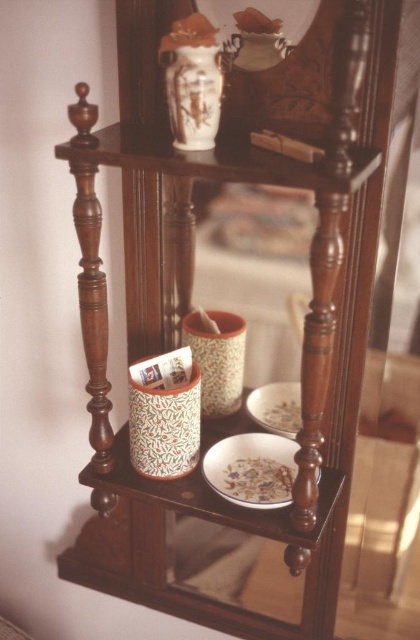
Is point (176, 145) in front of point (260, 413)?

That is True.

Between porcelain vase at upper center and white glossy plate at lower center, which one has more height?

With more height is porcelain vase at upper center.

Find the location of `porcelain vase at upper center`. porcelain vase at upper center is located at coordinates (191, 92).

Does white glossy plate at center appear under porcelain vase at upper center?

Yes, white glossy plate at center is below porcelain vase at upper center.

Who is positioned more to the right, white glossy plate at center or porcelain vase at upper center?

white glossy plate at center

At what (x,y) coordinates should I click in order to perform the action: click on white glossy plate at center. Please return your answer as a coordinate pair (x, y). The width and height of the screenshot is (420, 640). Looking at the image, I should click on (252, 468).

The width and height of the screenshot is (420, 640). Find the location of `white glossy plate at center`. white glossy plate at center is located at coordinates (252, 468).

Is flaky pastry at lower center taller than white matte bowl at lower center?

Yes, flaky pastry at lower center is taller than white matte bowl at lower center.

Is flaky pastry at lower center to the right of white matte bowl at lower center from the viewer's perspective?

No, flaky pastry at lower center is not to the right of white matte bowl at lower center.

Locate an element on the screen. This screenshot has height=640, width=420. flaky pastry at lower center is located at coordinates (259, 481).